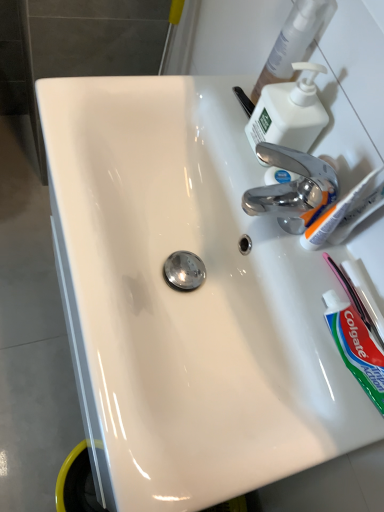
Question: Considering the relative positions of green matte toothpaste at lower right and pink plastic toothbrush at lower right, which appears as the 2th toothbrush when viewed from the left, in the image provided, is green matte toothpaste at lower right to the left or to the right of pink plastic toothbrush at lower right, which appears as the 2th toothbrush when viewed from the left,?

Choices:
 (A) right
 (B) left

Answer: (B)

Question: Is point (354, 328) closer or farther from the camera than point (367, 324)?

Choices:
 (A) farther
 (B) closer

Answer: (B)

Question: Which object is the closest to the green matte toothpaste at lower right?

Choices:
 (A) white plastic toothbrush at upper right, which is counted as the 2th toothbrush, starting from the bottom
 (B) white plastic soap dispenser at upper right
 (C) pink plastic toothbrush at lower right, which ranks as the 1th toothbrush in right-to-left order

Answer: (C)

Question: Based on their relative distances, which object is nearer to the pink plastic toothbrush at lower right, which appears as the 2th toothbrush when viewed from the left?

Choices:
 (A) green matte toothpaste at lower right
 (B) white plastic toothbrush at upper right, positioned as the 1th toothbrush in top-to-bottom order
 (C) white plastic soap dispenser at upper right

Answer: (A)